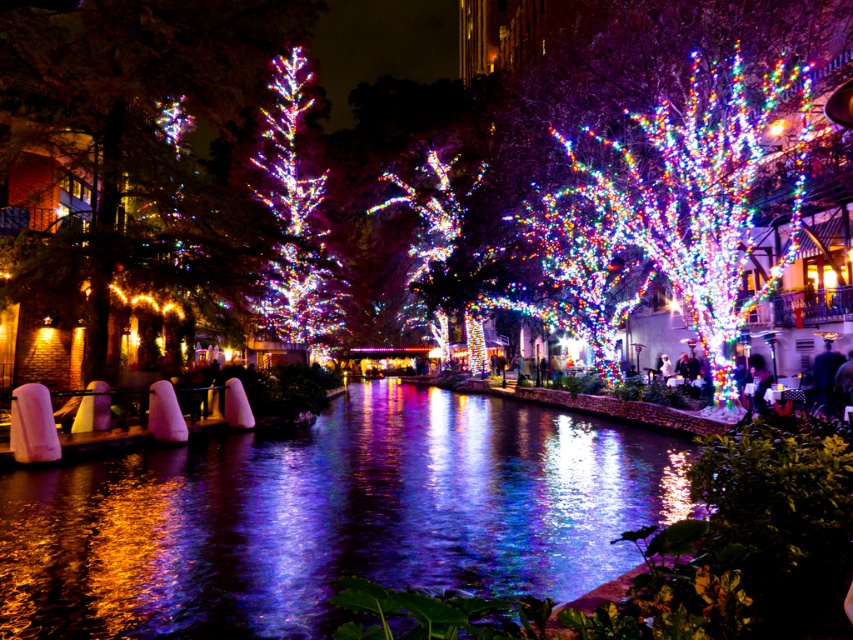
You are standing at the point closest to the riverbank in this scene. You notice two points marked on the image, one at coordinates point(453, 499) and the other at point(741, 320). If you want to move towards the point that is closer to you, which coordinate should you head towards?

Point(453, 499) is in front of point(741, 320), so you should head towards point(453, 499) as it is closer to your current position.

You are a photographer planning to capture the reflection of the iridescent glass tree at center in the glossy concrete river at center. Based on the scene description, will the tree be fully visible in the river?

The glossy concrete river at center is not as tall as the iridescent glass tree at center, so the tree will not be fully visible in the river because the river is shorter in height compared to the tree.